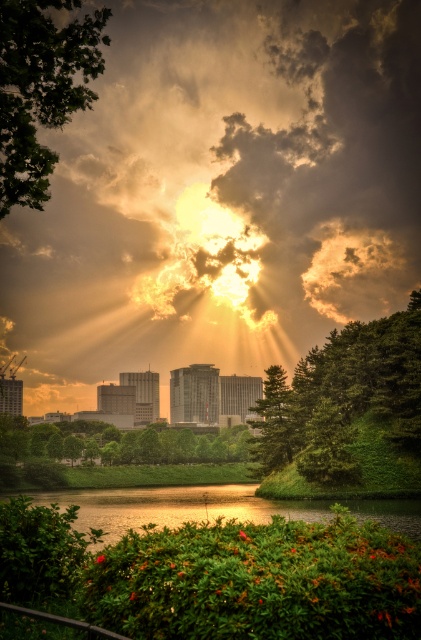
Who is taller, green leafy tree at upper left or glossy reflective water at lower center?

With more height is green leafy tree at upper left.

Is point (45, 1) farther from viewer compared to point (162, 509)?

No.

Is point (56, 84) closer to camera compared to point (116, 488)?

Yes, it is in front of point (116, 488).

Where is `green leafy tree at upper left`? The image size is (421, 640). green leafy tree at upper left is located at coordinates (40, 88).

Locate an element on the screen. This screenshot has width=421, height=640. glossy reflective water at lower center is located at coordinates (213, 508).

Can you confirm if glossy reflective water at lower center is wider than green leafy tree at lower left?

No, glossy reflective water at lower center is not wider than green leafy tree at lower left.

Where is `glossy reflective water at lower center`? The width and height of the screenshot is (421, 640). glossy reflective water at lower center is located at coordinates (213, 508).

Can you confirm if green textured tree at right is shorter than green leafy tree at lower left?

No, green textured tree at right is not shorter than green leafy tree at lower left.

Who is positioned more to the right, green textured tree at right or green leafy tree at lower left?

green textured tree at right is more to the right.

Is point (405, 336) farther from camera compared to point (125, 442)?

No, it is in front of (125, 442).

At what (x,y) coordinates should I click in order to perform the action: click on green textured tree at right. Please return your answer as a coordinate pair (x, y). Looking at the image, I should click on (346, 413).